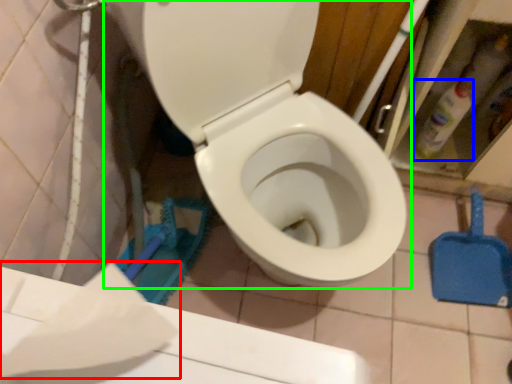
Question: Which object is positioned closest to toilet paper (highlighted by a red box)? Select from cleaning product (highlighted by a blue box) and toilet (highlighted by a green box).

Choices:
 (A) cleaning product
 (B) toilet

Answer: (B)